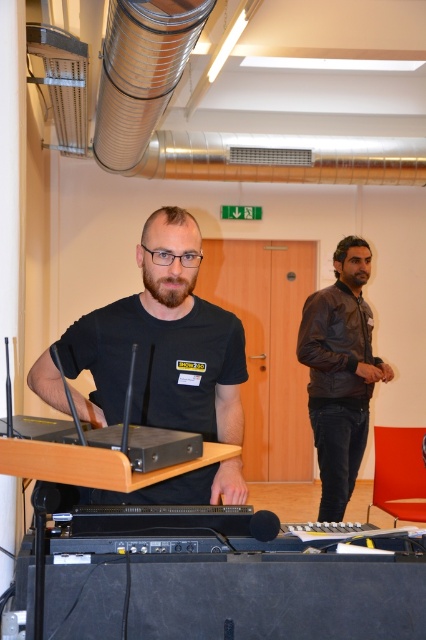
You are organizing a tech event and need to place a new laptop that is the same size as the black plastic laptop at center onto a shelf. The shelf has a space that can only accommodate items smaller than the leather jacket at right. Will the new laptop fit?

The leather jacket at right is larger in size than the black plastic laptop at center. Since the shelf can only hold items smaller than the leather jacket, the new laptop, being the same size as the black plastic laptop at center, will fit on the shelf.

You are an assistant in the workshop and need to locate the black plastic laptop at center. Where should you look relative to the leather jacket at right?

The black plastic laptop at center is above the leather jacket at right since the leather jacket at right is below it.

You are a technician in the workshop. You need to place a new label on the object that is taller between the leather jacket at right and the black plastic laptop at center. Which object should you label?

The leather jacket at right is much taller than the black plastic laptop at center, so you should label the leather jacket at right.